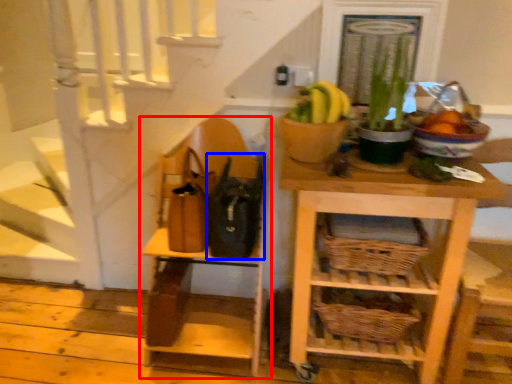
Question: Which object is further to the camera taking this photo, shelf (highlighted by a red box) or bag (highlighted by a blue box)?

Choices:
 (A) shelf
 (B) bag

Answer: (B)